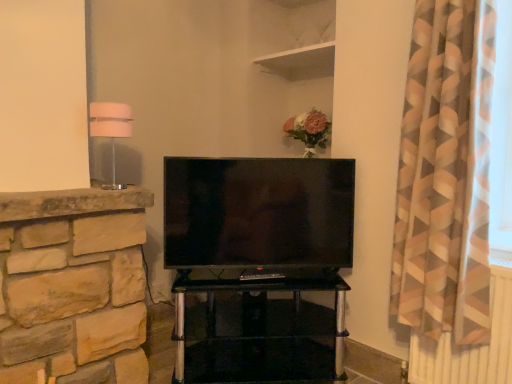
Question: Is white fabric lampshade at left looking in the opposite direction of matte black tv at center?

Choices:
 (A) yes
 (B) no

Answer: (B)

Question: Can you confirm if white fabric lampshade at left is positioned to the right of matte black tv at center?

Choices:
 (A) yes
 (B) no

Answer: (B)

Question: From the image's perspective, is white fabric lampshade at left on matte black tv at center?

Choices:
 (A) yes
 (B) no

Answer: (A)

Question: Would you consider white fabric lampshade at left to be distant from matte black tv at center?

Choices:
 (A) yes
 (B) no

Answer: (B)

Question: Is white fabric lampshade at left positioned before matte black tv at center?

Choices:
 (A) yes
 (B) no

Answer: (A)

Question: From a real-world perspective, is white matte shelf at upper center, the first shelf positioned from the top, above or below transparent glass tv stand at center?

Choices:
 (A) above
 (B) below

Answer: (A)

Question: From the image's perspective, is white matte shelf at upper center, the first shelf positioned from the top, positioned above or below transparent glass tv stand at center?

Choices:
 (A) above
 (B) below

Answer: (A)

Question: Which is correct: white matte shelf at upper center, the first shelf positioned from the top, is inside transparent glass tv stand at center, or outside of it?

Choices:
 (A) inside
 (B) outside

Answer: (B)

Question: Looking at the image, does white matte shelf at upper center, the first shelf positioned from the top, seem bigger or smaller compared to transparent glass tv stand at center?

Choices:
 (A) big
 (B) small

Answer: (B)

Question: Considering the positions of white fabric lampshade at left and white matte shelf at upper center, the first shelf positioned from the top, in the image, is white fabric lampshade at left taller or shorter than white matte shelf at upper center, the first shelf positioned from the top,?

Choices:
 (A) tall
 (B) short

Answer: (A)

Question: In terms of size, does white fabric lampshade at left appear bigger or smaller than white matte shelf at upper center, the first shelf positioned from the top?

Choices:
 (A) small
 (B) big

Answer: (A)

Question: Is white fabric lampshade at left wider or thinner than white matte shelf at upper center, acting as the 2th shelf starting from the bottom?

Choices:
 (A) wide
 (B) thin

Answer: (B)

Question: In the image, is white fabric lampshade at left positioned in front of or behind white matte shelf at upper center, the first shelf positioned from the top?

Choices:
 (A) behind
 (B) front

Answer: (B)

Question: Considering the positions of point (224, 187) and point (442, 223), is point (224, 187) closer or farther from the camera than point (442, 223)?

Choices:
 (A) closer
 (B) farther

Answer: (B)

Question: From a real-world perspective, relative to geometric-patterned fabric curtain at right, is matte black tv at center vertically above or below?

Choices:
 (A) below
 (B) above

Answer: (A)